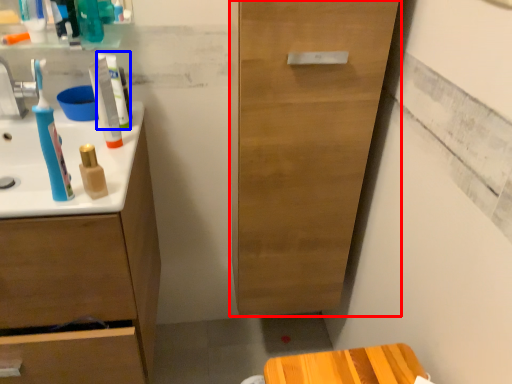
Question: Which of the following is the farthest to the observer, cabinetry (highlighted by a red box) or toothpaste (highlighted by a blue box)?

Choices:
 (A) cabinetry
 (B) toothpaste

Answer: (B)